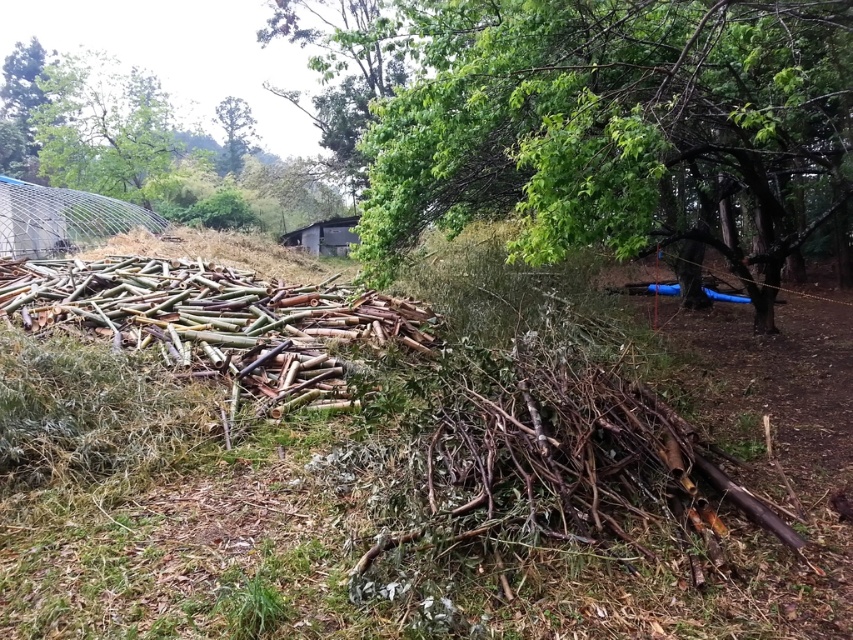
You are standing at the origin point in the image. Which direction should you move to reach the green leafy tree at center?

You should move towards the point at coordinates 0.205 on the x axis and 0.727 on the y axis to reach the green leafy tree at center.